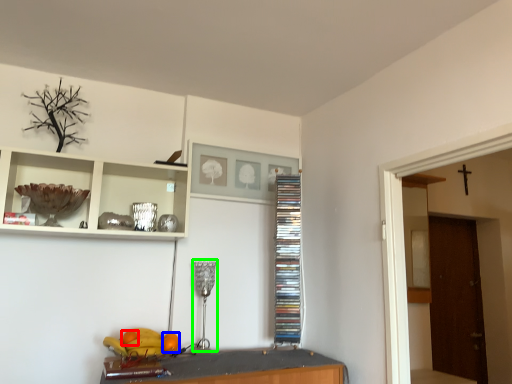
Question: Considering the real-world distances, which object is closest to orange (highlighted by a red box)? orange (highlighted by a blue box) or lamp (highlighted by a green box).

Choices:
 (A) orange
 (B) lamp

Answer: (A)